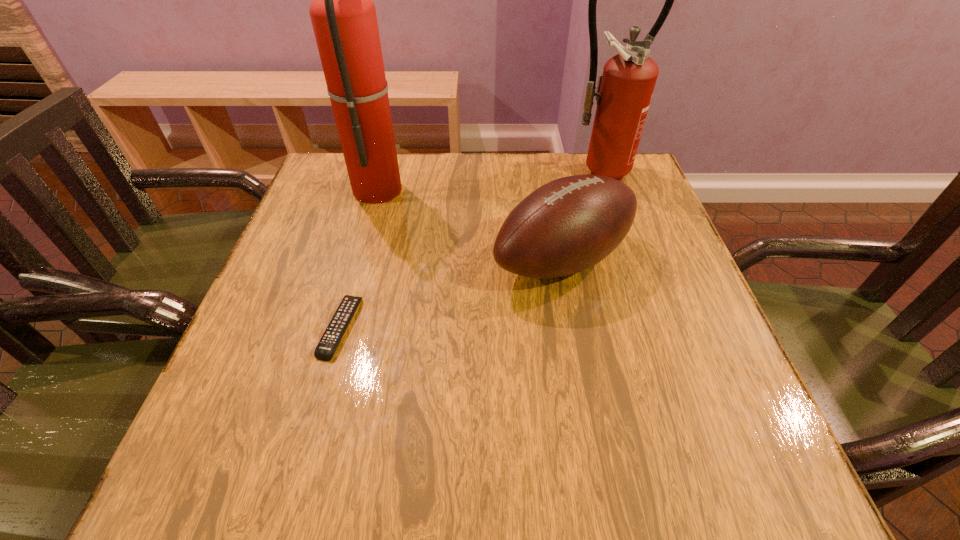
Locate which object ranks third in proximity to the shortest object. Please provide its 2D coordinates. Your answer should be formatted as a tuple, i.e. [(x, y)], where the tuple contains the x and y coordinates of a point satisfying the conditions above.

[(624, 91)]

Locate an element on the screen. This screenshot has height=540, width=960. free space that satisfies the following two spatial constraints: 1. with the nozzle and gauge on the left fire extinguisher; 2. on the right side of the third tallest object is located at coordinates (358, 260).

The image size is (960, 540). I want to click on free location that satisfies the following two spatial constraints: 1. at the nozzle of the right fire extinguisher; 2. with the nozzle and gauge on the left fire extinguisher, so click(x=601, y=188).

I want to click on free space that satisfies the following two spatial constraints: 1. at the nozzle of the right fire extinguisher; 2. with the nozzle and gauge on the left fire extinguisher, so click(601, 188).

Locate an element on the screen. The width and height of the screenshot is (960, 540). free location that satisfies the following two spatial constraints: 1. with the nozzle and gauge on the football (American); 2. on the left side of the left fire extinguisher is located at coordinates pyautogui.click(x=358, y=260).

Identify the location of vacant space that satisfies the following two spatial constraints: 1. with the nozzle and gauge on the shortest object; 2. on the left side of the left fire extinguisher. (339, 327).

The image size is (960, 540). What are the coordinates of `free space in the image that satisfies the following two spatial constraints: 1. at the nozzle of the right fire extinguisher; 2. with the nozzle and gauge on the left fire extinguisher` in the screenshot? It's located at (601, 188).

Locate an element on the screen. The height and width of the screenshot is (540, 960). free point that satisfies the following two spatial constraints: 1. at the nozzle of the right fire extinguisher; 2. with the nozzle and gauge on the left fire extinguisher is located at coordinates (601, 188).

Find the location of `vacant point that satisfies the following two spatial constraints: 1. with the nozzle and gauge on the left fire extinguisher; 2. on the back side of the shortest object`. vacant point that satisfies the following two spatial constraints: 1. with the nozzle and gauge on the left fire extinguisher; 2. on the back side of the shortest object is located at coordinates (339, 327).

At what (x,y) coordinates should I click in order to perform the action: click on free spot that satisfies the following two spatial constraints: 1. at the nozzle of the right fire extinguisher; 2. with the nozzle and gauge on the left fire extinguisher. Please return your answer as a coordinate pair (x, y). Looking at the image, I should click on (601, 188).